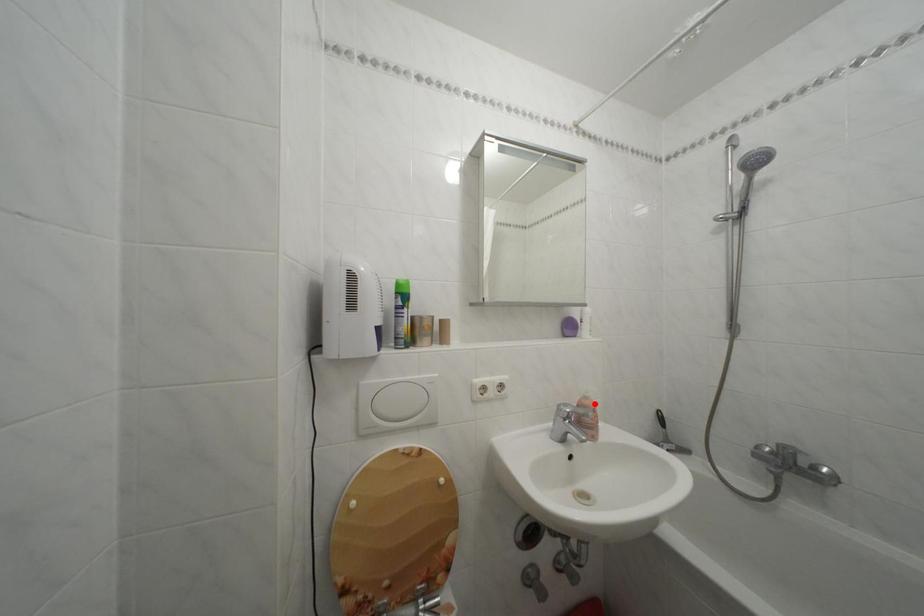
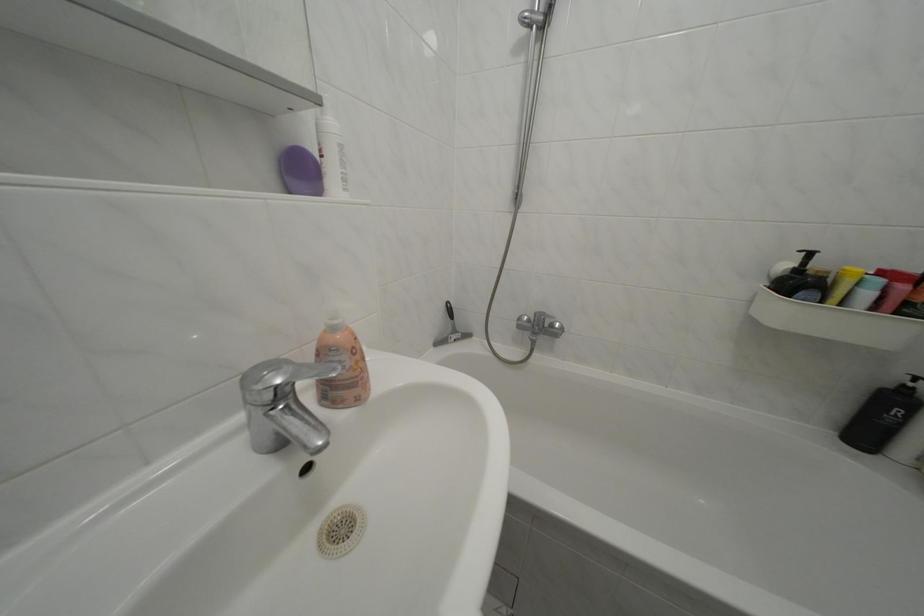
Find the pixel in the second image that matches the highlighted location in the first image.

(342, 334)